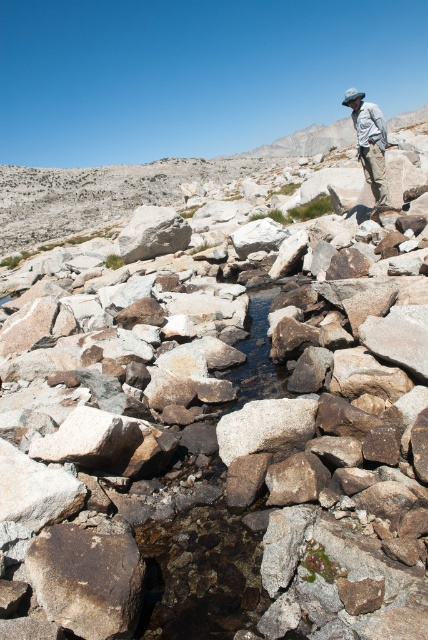
Between smooth granite rocks at center and gray granite boulder at center, which one is positioned higher?

Positioned higher is smooth granite rocks at center.

Can you confirm if smooth granite rocks at center is bigger than gray granite boulder at center?

Yes.

Does point (38, 193) come in front of point (172, 241)?

No.

Where is `smooth granite rocks at center`? smooth granite rocks at center is located at coordinates (134, 184).

Which is more to the left, smooth granite rocks at center or light brown fabric hat at upper right?

From the viewer's perspective, light brown fabric hat at upper right appears more on the left side.

Based on the photo, which of these two, smooth granite rocks at center or light brown fabric hat at upper right, stands shorter?

light brown fabric hat at upper right is shorter.

Which is in front, point (73, 170) or point (385, 198)?

Positioned in front is point (385, 198).

The image size is (428, 640). Find the location of `smooth granite rocks at center`. smooth granite rocks at center is located at coordinates (134, 184).

Can you confirm if gray granite boulder at center is taller than light brown fabric hat at upper right?

In fact, gray granite boulder at center may be shorter than light brown fabric hat at upper right.

Does point (180, 221) lie behind point (365, 106)?

Yes.

Where is `gray granite boulder at center`? The width and height of the screenshot is (428, 640). gray granite boulder at center is located at coordinates [152, 234].